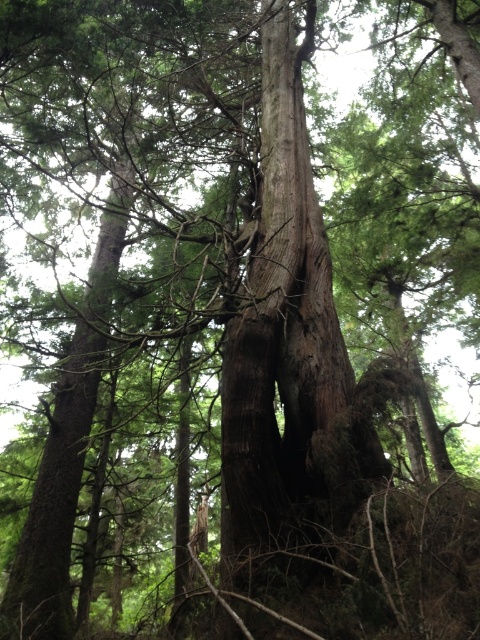
Question: Can you confirm if smooth brown bark at center is positioned to the right of smooth brown tree trunk at center?

Choices:
 (A) no
 (B) yes

Answer: (B)

Question: Which object is closer to the camera taking this photo?

Choices:
 (A) smooth brown tree trunk at center
 (B) smooth brown bark at center

Answer: (B)

Question: Does smooth brown bark at center appear on the left side of smooth brown tree trunk at center?

Choices:
 (A) yes
 (B) no

Answer: (B)

Question: Is smooth brown bark at center wider than smooth brown tree trunk at center?

Choices:
 (A) no
 (B) yes

Answer: (B)